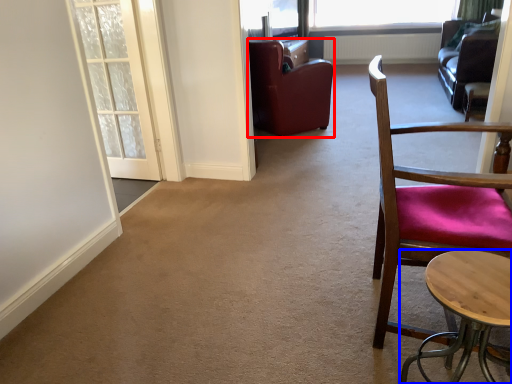
Question: Among these objects, which one is nearest to the camera, chair (highlighted by a red box) or table (highlighted by a blue box)?

Choices:
 (A) chair
 (B) table

Answer: (B)